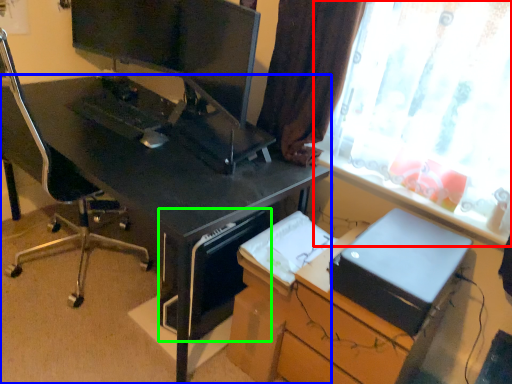
Question: Which object is positioned closest to window (highlighted by a red box)? Select from desk (highlighted by a blue box) and computer tower (highlighted by a green box).

Choices:
 (A) desk
 (B) computer tower

Answer: (A)